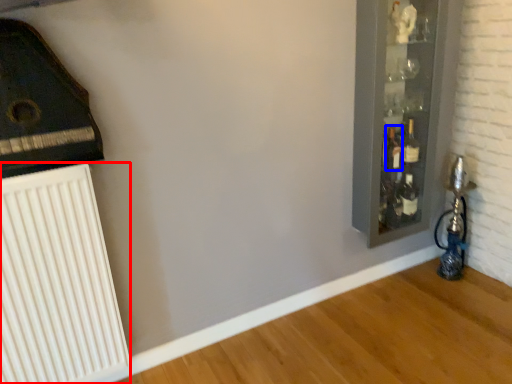
Question: Which point is closer to the camera, radiator (highlighted by a red box) or bottle (highlighted by a blue box)?

Choices:
 (A) radiator
 (B) bottle

Answer: (A)